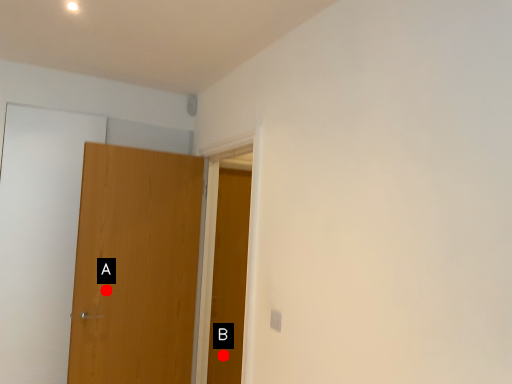
Question: Two points are circled on the image, labeled by A and B beside each circle. Which point appears farthest from the camera in this image?

Choices:
 (A) A is further
 (B) B is further

Answer: (B)